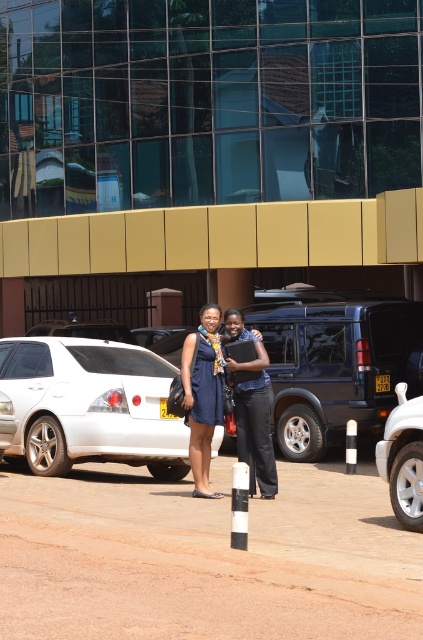
Can you confirm if brown dirt track at center is positioned above white matte car at lower right?

No, brown dirt track at center is not above white matte car at lower right.

The height and width of the screenshot is (640, 423). Identify the location of brown dirt track at center. (205, 561).

Between brown dirt track at center and metallic blue suv at center, which one appears on the right side from the viewer's perspective?

metallic blue suv at center

The width and height of the screenshot is (423, 640). I want to click on brown dirt track at center, so pos(205,561).

Is point (315, 552) in front of point (211, 308)?

Yes, point (315, 552) is in front of point (211, 308).

Is point (158, 554) positioned in front of point (211, 432)?

That is True.

Locate an element on the screen. The width and height of the screenshot is (423, 640). brown dirt track at center is located at coordinates (205, 561).